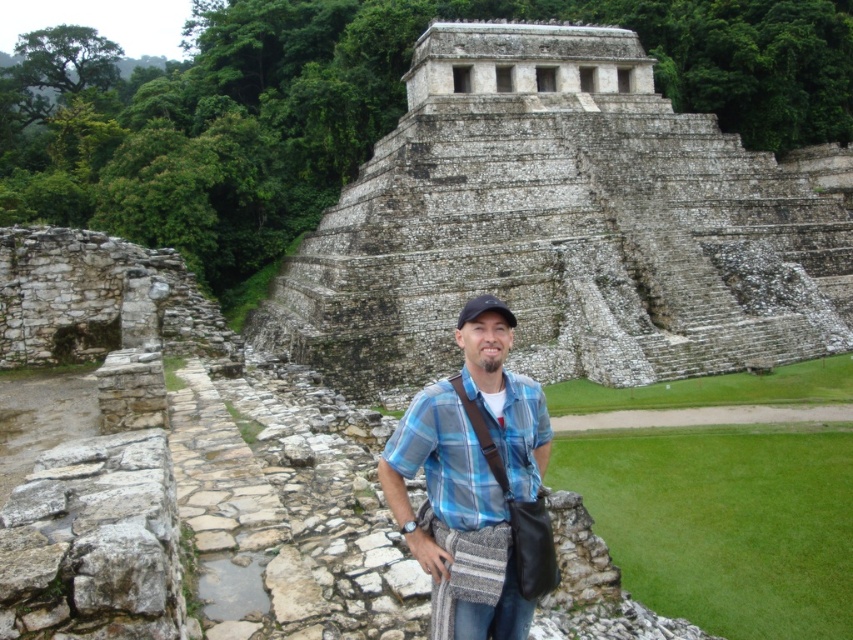
You are a photographer trying to capture the stone textured pyramid at center and the blue plaid shirt at center in the same frame. Which object should you focus on first to ensure both are in focus?

The stone textured pyramid at center is further to the viewer than the blue plaid shirt at center, so you should focus on the stone textured pyramid at center first to ensure both are in focus.

Consider the image. You are taking a photo of the stone textured pyramid at center and the blue plaid shirt at center. Which object should you focus on first if you want to capture both in the same frame without moving the camera?

The blue plaid shirt at center should be focused on first because the stone textured pyramid at center is to the right of it, so adjusting focus to the shirt ensures both are in frame.